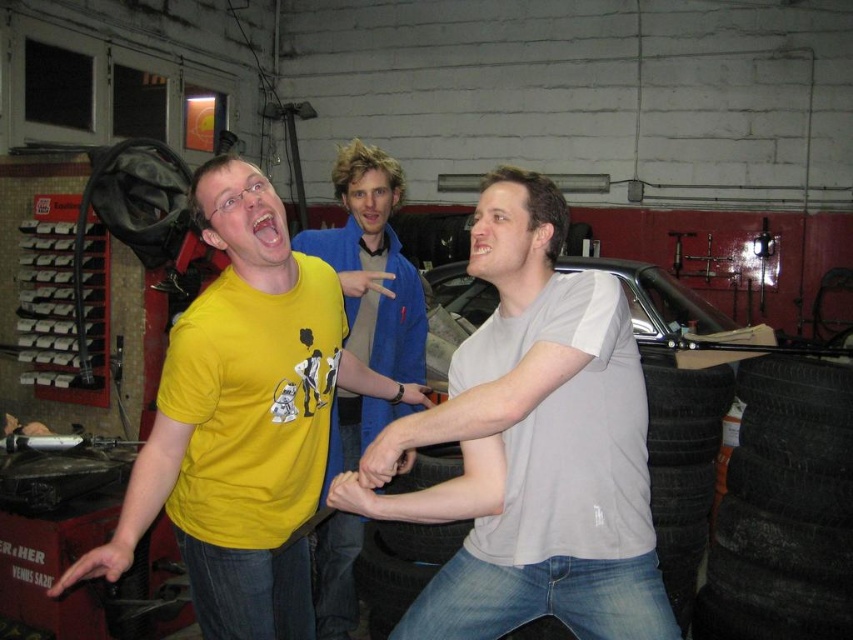
You are standing in the garage and see two points marked in the image. Which point is closer to you, point (503, 513) or point (422, 486)?

Point (503, 513) is closer to the viewer than point (422, 486).